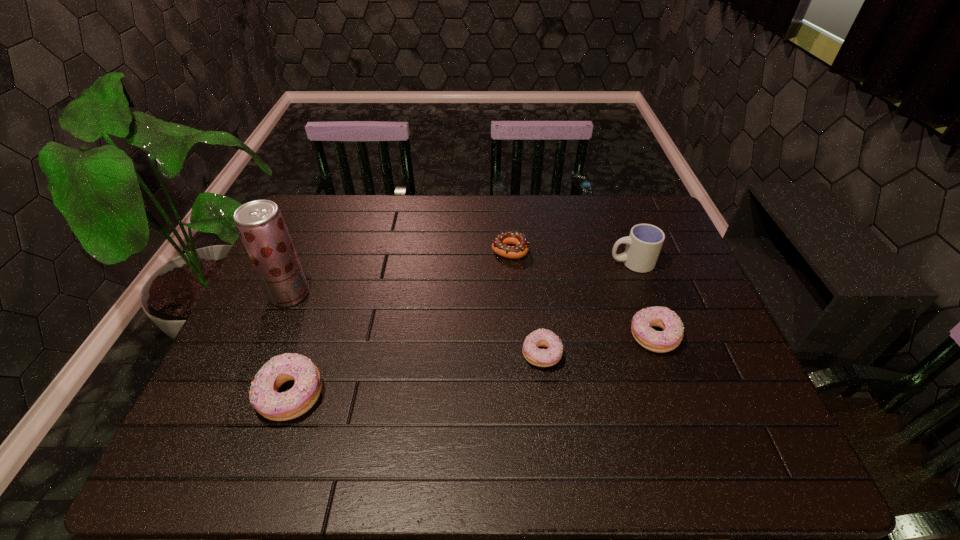
Image resolution: width=960 pixels, height=540 pixels. Identify the location of object at the near left corner. (264, 397).

Locate an element on the screen. vacant space at the far edge of the desktop is located at coordinates (466, 196).

You are a GUI agent. You are given a task and a screenshot of the screen. Output one action in this format:
    pyautogui.click(x=<x>, y=<y>)
    Task: Click on the free region at the left edge of the desktop
    
    Given the screenshot: What is the action you would take?
    pyautogui.click(x=301, y=318)

Find the location of a particular element. The width and height of the screenshot is (960, 540). vacant space at the right edge is located at coordinates (669, 259).

Locate an element on the screen. The image size is (960, 540). vacant space at the far right corner of the desktop is located at coordinates (630, 206).

Locate an element on the screen. free space between the third tallest object and the farthest doughnut is located at coordinates (400, 323).

Image resolution: width=960 pixels, height=540 pixels. I want to click on vacant space that is in between the cup and the second tallest doughnut, so click(642, 300).

Where is `vacant point located between the third shortest object and the farthest doughnut`? The height and width of the screenshot is (540, 960). vacant point located between the third shortest object and the farthest doughnut is located at coordinates (582, 293).

Find the location of `unoccupied position between the leftmost doughnut and the second tallest object`. unoccupied position between the leftmost doughnut and the second tallest object is located at coordinates (462, 329).

Locate an element on the screen. The image size is (960, 540). free space that is in between the fourth nearest object and the third shortest object is located at coordinates (471, 315).